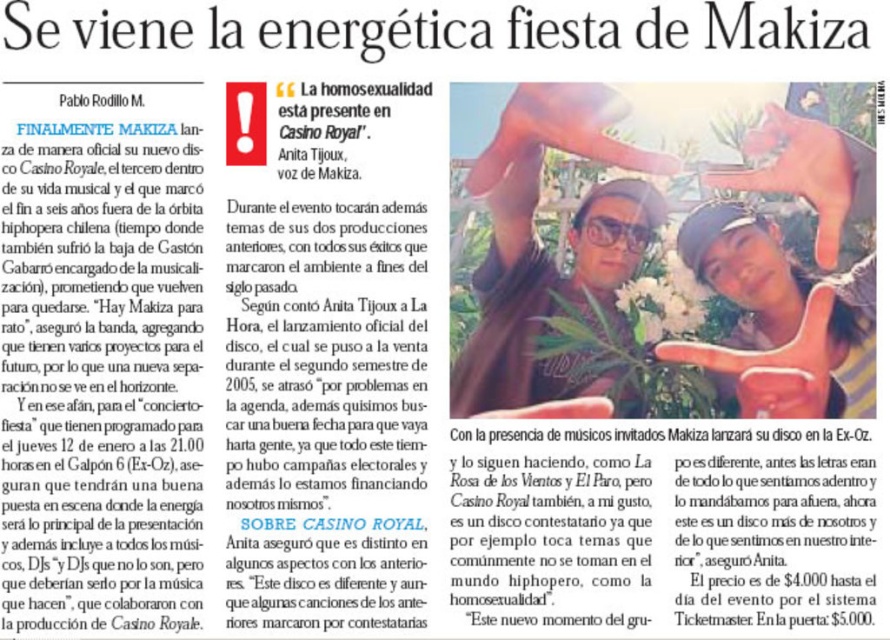
Consider the image. You are a graphic designer working on this newspaper layout. You need to place a new element between the point at (864, 323) and the point at (578, 221). Which point should the new element be closer to if it needs to appear more prominent in the layout?

The new element should be placed closer to the point at (864, 323) because it is closer to the viewer than the point at (578, 221), making it more prominent in the layout.

You are a photographer who needs to take a closeup shot of the matte black cap at upper right and the matte black sunglasses at center. Which object should you focus on first to ensure both are in focus without moving the camera?

The matte black cap at upper right is in front of the matte black sunglasses at center, so you should focus on the matte black cap at upper right first to ensure both are in focus.